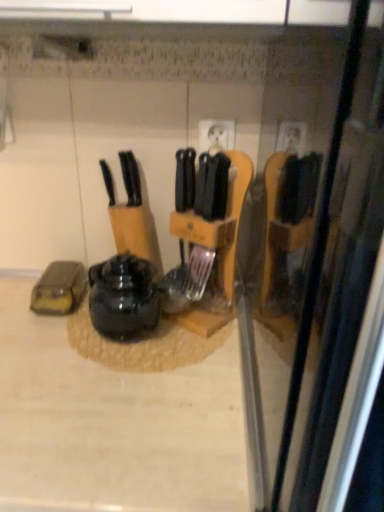
Question: In terms of size, does shiny black kettle at center appear bigger or smaller than black plastic knife at center?

Choices:
 (A) big
 (B) small

Answer: (A)

Question: From the image's perspective, is shiny black kettle at center located above or below black plastic knife at center?

Choices:
 (A) above
 (B) below

Answer: (B)

Question: Which of these objects is positioned farthest from the beige laminate counter at center?

Choices:
 (A) shiny black kettle at center
 (B) black plastic knife at center

Answer: (B)

Question: Which object is the closest to the beige laminate counter at center?

Choices:
 (A) shiny black kettle at center
 (B) black plastic knife at center

Answer: (A)